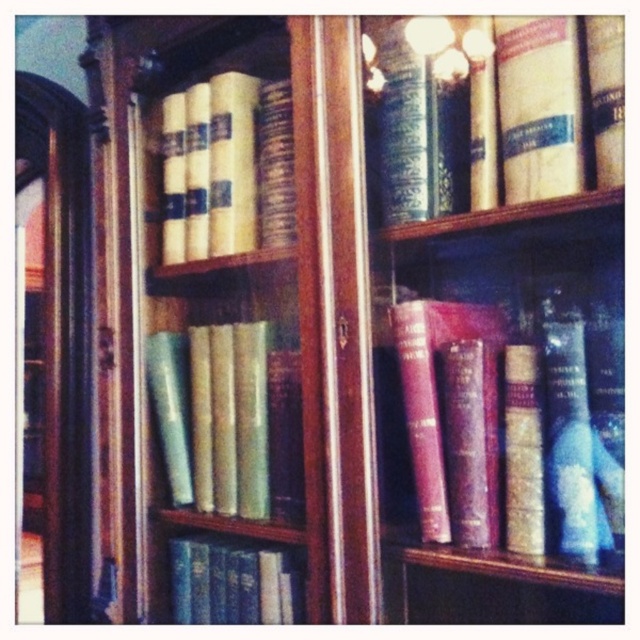
You are a librarian who wants to place a new book on the shelf. The bookshelf has a coordinate system where the bottom left corner is the origin point. The new book must be placed at the same 2D location as the maroon leather book at center. What are the coordinates where you should place the new book?

The maroon leather book at center is located at coordinates point (516, 420), so you should place the new book at the same coordinates point (516, 420).

You are organizing books on a wooden bookshelf and need to place a new book between the maroon leather book at center and the green leather book at center. The new book is 12 centimeters thick. Is there enough space between them to fit the new book?

The maroon leather book at center and green leather book at center are 25.67 centimeters apart from each other. Since the new book is 12 centimeters thick, there is sufficient space between them to fit the new book as 25.67 cm is greater than 12 cm.

You are a librarian who needs to place a new book that is 10 inches wide on the shelf between the hardcover book at upper center and the green leather book at center. Can the new book fit in the space between them?

The space between the hardcover book at upper center and the green leather book at center is 12.55 inches. Since the new book is 10 inches wide, it can fit in the space between them.